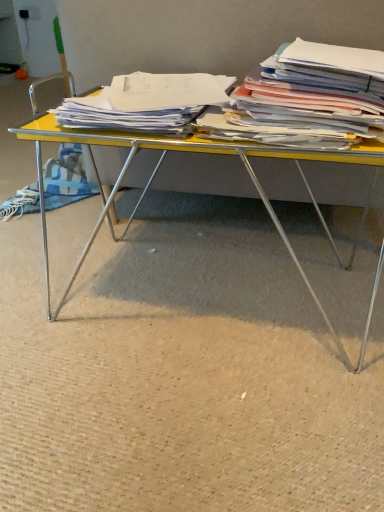
What is the approximate height of white paper stack at right, which is the first magazine in right-to-left order?

It is 6.24 inches.

What do you see at coordinates (146, 103) in the screenshot? I see `white paper at center, which is the 1th magazine in left-to-right order` at bounding box center [146, 103].

Image resolution: width=384 pixels, height=512 pixels. I want to click on white paper stack at right, placed as the second magazine when sorted from left to right, so click(309, 98).

Considering the positions of objects white paper stack at right, placed as the second magazine when sorted from left to right, and yellow plastic desk at center in the image provided, who is more to the left, white paper stack at right, placed as the second magazine when sorted from left to right, or yellow plastic desk at center?

yellow plastic desk at center.

Is white paper stack at right, placed as the second magazine when sorted from left to right, bigger or smaller than yellow plastic desk at center?

white paper stack at right, placed as the second magazine when sorted from left to right, is smaller than yellow plastic desk at center.

Is white paper stack at right, placed as the second magazine when sorted from left to right, aimed at yellow plastic desk at center?

No, white paper stack at right, placed as the second magazine when sorted from left to right, does not turn towards yellow plastic desk at center.

Locate an element on the screen. the 2nd magazine positioned above the yellow plastic desk at center (from a real-world perspective) is located at coordinates (309, 98).

Considering the positions of objects white paper stack at right, placed as the second magazine when sorted from left to right, and white paper at center, which is the 1th magazine in left-to-right order, in the image provided, who is in front, white paper stack at right, placed as the second magazine when sorted from left to right, or white paper at center, which is the 1th magazine in left-to-right order,?

white paper stack at right, placed as the second magazine when sorted from left to right.

Which of these two, white paper stack at right, placed as the second magazine when sorted from left to right, or white paper at center, which is the 1th magazine in left-to-right order, stands taller?

white paper stack at right, placed as the second magazine when sorted from left to right, is taller.

Which is more to the right, white paper stack at right, which is the first magazine in right-to-left order, or white paper at center, the second magazine viewed from the right?

white paper stack at right, which is the first magazine in right-to-left order.

Is white paper stack at right, which is the first magazine in right-to-left order, far from white paper at center, the second magazine viewed from the right?

white paper stack at right, which is the first magazine in right-to-left order, is actually quite close to white paper at center, the second magazine viewed from the right.

Which is more to the right, white paper at center, the second magazine viewed from the right, or white paper stack at right, placed as the second magazine when sorted from left to right?

white paper stack at right, placed as the second magazine when sorted from left to right.

What's the angular difference between white paper at center, the second magazine viewed from the right, and white paper stack at right, placed as the second magazine when sorted from left to right,'s facing directions?

The angle between the facing direction of white paper at center, the second magazine viewed from the right, and the facing direction of white paper stack at right, placed as the second magazine when sorted from left to right, is 0.826 degrees.

Which is behind, point (69, 114) or point (357, 118)?

The point (69, 114) is farther from the camera.

Considering their positions, is white paper at center, which is the 1th magazine in left-to-right order, located in front of or behind white paper stack at right, placed as the second magazine when sorted from left to right?

Clearly, white paper at center, which is the 1th magazine in left-to-right order, is behind white paper stack at right, placed as the second magazine when sorted from left to right.

From a real-world perspective, is yellow plastic desk at center positioned over white paper at center, the second magazine viewed from the right, based on gravity?

No.

Considering the sizes of objects yellow plastic desk at center and white paper at center, the second magazine viewed from the right, in the image provided, who is wider, yellow plastic desk at center or white paper at center, the second magazine viewed from the right,?

Wider between the two is yellow plastic desk at center.

Is yellow plastic desk at center spatially inside white paper at center, the second magazine viewed from the right, or outside of it?

yellow plastic desk at center is located beyond the bounds of white paper at center, the second magazine viewed from the right.

Does point (42, 221) appear closer or farther from the camera than point (289, 78)?

Clearly, point (42, 221) is more distant from the camera than point (289, 78).

From a real-world perspective, which object stands above the other?

white paper stack at right, placed as the second magazine when sorted from left to right, from a real-world perspective.

Can you confirm if yellow plastic desk at center is positioned to the right of white paper stack at right, placed as the second magazine when sorted from left to right?

Incorrect, yellow plastic desk at center is not on the right side of white paper stack at right, placed as the second magazine when sorted from left to right.

From a real-world perspective, between white paper at center, which is the 1th magazine in left-to-right order, and yellow plastic desk at center, who is vertically lower?

yellow plastic desk at center is physically lower.

Between white paper at center, the second magazine viewed from the right, and yellow plastic desk at center, which one has smaller size?

white paper at center, the second magazine viewed from the right, is smaller.

From the image's perspective, which one is positioned lower, white paper at center, which is the 1th magazine in left-to-right order, or yellow plastic desk at center?

yellow plastic desk at center.

At what (x,y) coordinates should I click in order to perform the action: click on desk directly beneath the white paper at center, the second magazine viewed from the right (from a real-world perspective). Please return your answer as a coordinate pair (x, y). The image size is (384, 512). Looking at the image, I should click on (155, 176).

From a real-world perspective, starting from the yellow plastic desk at center, which magazine is the 2nd one vertically above it? Please provide its 2D coordinates.

[(309, 98)]

Find the location of a particular element. This screenshot has width=384, height=512. magazine below the white paper at center, which is the 1th magazine in left-to-right order (from the image's perspective) is located at coordinates (309, 98).

Which object lies nearer to the anchor point yellow plastic desk at center, white paper at center, the second magazine viewed from the right, or white paper stack at right, placed as the second magazine when sorted from left to right?

Based on the image, white paper at center, the second magazine viewed from the right, appears to be nearer to yellow plastic desk at center.

Looking at the image, which one is located closer to white paper stack at right, placed as the second magazine when sorted from left to right, yellow plastic desk at center or white paper at center, the second magazine viewed from the right?

The object closer to white paper stack at right, placed as the second magazine when sorted from left to right, is white paper at center, the second magazine viewed from the right.

Looking at the image, which one is located further to white paper at center, the second magazine viewed from the right, yellow plastic desk at center or white paper stack at right, which is the first magazine in right-to-left order?

yellow plastic desk at center is further to white paper at center, the second magazine viewed from the right.

Based on their spatial positions, is white paper stack at right, which is the first magazine in right-to-left order, or yellow plastic desk at center closer to white paper at center, which is the 1th magazine in left-to-right order?

white paper stack at right, which is the first magazine in right-to-left order, is closer to white paper at center, which is the 1th magazine in left-to-right order.

Looking at the image, which one is located closer to white paper stack at right, which is the first magazine in right-to-left order, white paper at center, which is the 1th magazine in left-to-right order, or yellow plastic desk at center?

white paper at center, which is the 1th magazine in left-to-right order.

Based on their spatial positions, is white paper stack at right, placed as the second magazine when sorted from left to right, or white paper at center, the second magazine viewed from the right, further from yellow plastic desk at center?

Among the two, white paper stack at right, placed as the second magazine when sorted from left to right, is located further to yellow plastic desk at center.

The width and height of the screenshot is (384, 512). I want to click on desk situated between white paper at center, the second magazine viewed from the right, and white paper stack at right, which is the first magazine in right-to-left order, from left to right, so click(x=155, y=176).